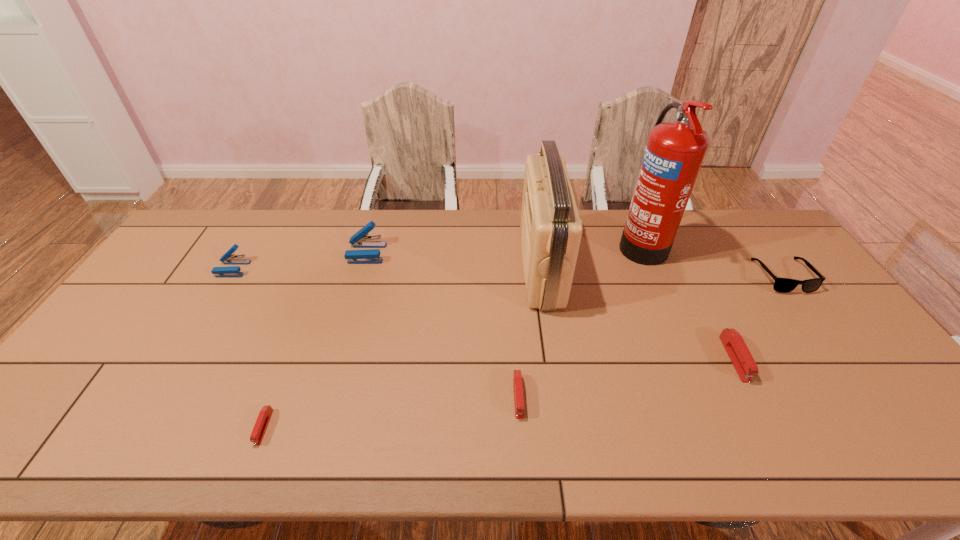
You are a GUI agent. You are given a task and a screenshot of the screen. Output one action in this format:
    pyautogui.click(x=<x>, y=<y>)
    Task: Click on the rightmost stapler
    The height and width of the screenshot is (540, 960).
    Given the screenshot: What is the action you would take?
    pyautogui.click(x=737, y=350)

You are a GUI agent. You are given a task and a screenshot of the screen. Output one action in this format:
    pyautogui.click(x=<x>, y=<y>)
    Task: Click on the second red stapler from right to left
    
    Given the screenshot: What is the action you would take?
    pyautogui.click(x=517, y=375)

Identify the location of the second biggest red stapler. The width and height of the screenshot is (960, 540). (517, 375).

You are a GUI agent. You are given a task and a screenshot of the screen. Output one action in this format:
    pyautogui.click(x=<x>, y=<y>)
    Task: Click on the smallest red stapler
    
    Given the screenshot: What is the action you would take?
    pyautogui.click(x=264, y=416)

Image resolution: width=960 pixels, height=540 pixels. Find the location of `the second object from left to right`. the second object from left to right is located at coordinates (264, 416).

Find the location of `vacant point located 0.210m on the surface of the fire extinguisher`. vacant point located 0.210m on the surface of the fire extinguisher is located at coordinates (556, 243).

Locate an element on the screen. The width and height of the screenshot is (960, 540). vacant point located 0.130m on the surface of the fire extinguisher is located at coordinates (579, 243).

This screenshot has height=540, width=960. Identify the location of vacant space located 0.260m on the surface of the fire extinguisher. (541, 243).

Find the location of `vacant space located on the front-facing side of the beige radio receiver`. vacant space located on the front-facing side of the beige radio receiver is located at coordinates 466,268.

Where is `free space located 0.280m on the front-facing side of the beige radio receiver`? Image resolution: width=960 pixels, height=540 pixels. free space located 0.280m on the front-facing side of the beige radio receiver is located at coordinates (435, 268).